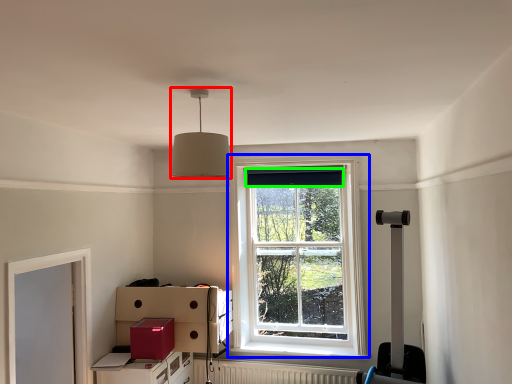
Question: Which object is the farthest from lamp (highlighted by a red box)? Choose among these: window (highlighted by a blue box) or curtain (highlighted by a green box).

Choices:
 (A) window
 (B) curtain

Answer: (A)